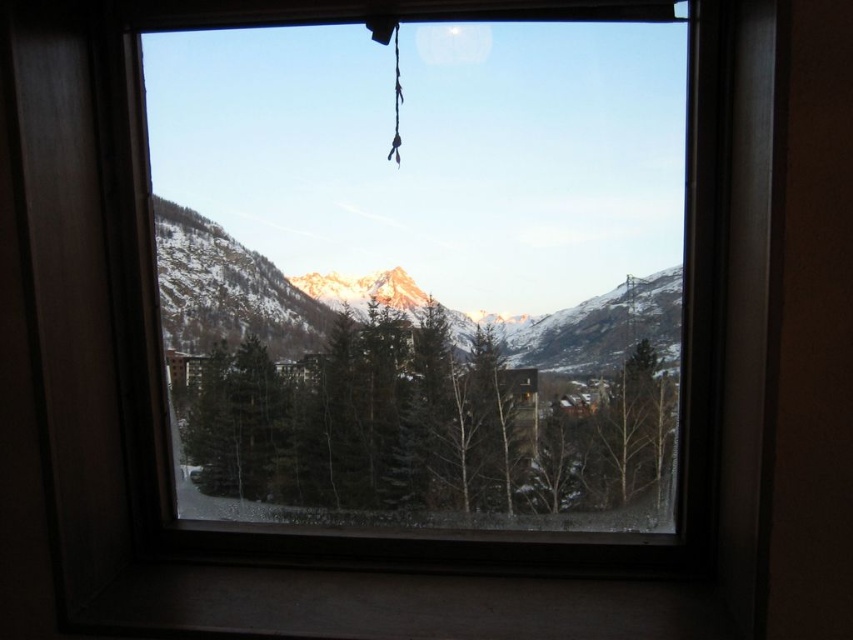
You are an interior designer assessing the view from a window. You notice the green matte tree at center and the snowy mountain at center. Which object appears wider in the scene?

The snowy mountain at center appears wider than the green matte tree at center because the green matte tree at center has a lesser width compared to snowy mountain at center.

From the picture: You are an interior designer assessing the view from a window. You notice the green matte tree at center and the snowy mountain at center. Which object appears taller in the scene?

The green matte tree at center appears taller than the snowy mountain at center.

You are standing in a room with a window. You see a green matte tree at center and a snowy mountain at center. Which object is positioned to the right of the other?

The green matte tree at center is to the right of snowy mountain at center.